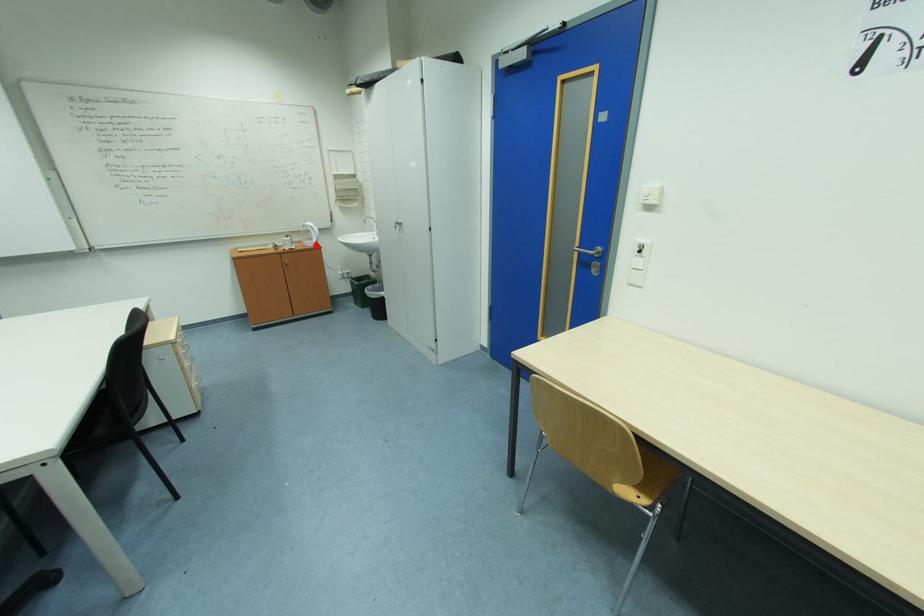
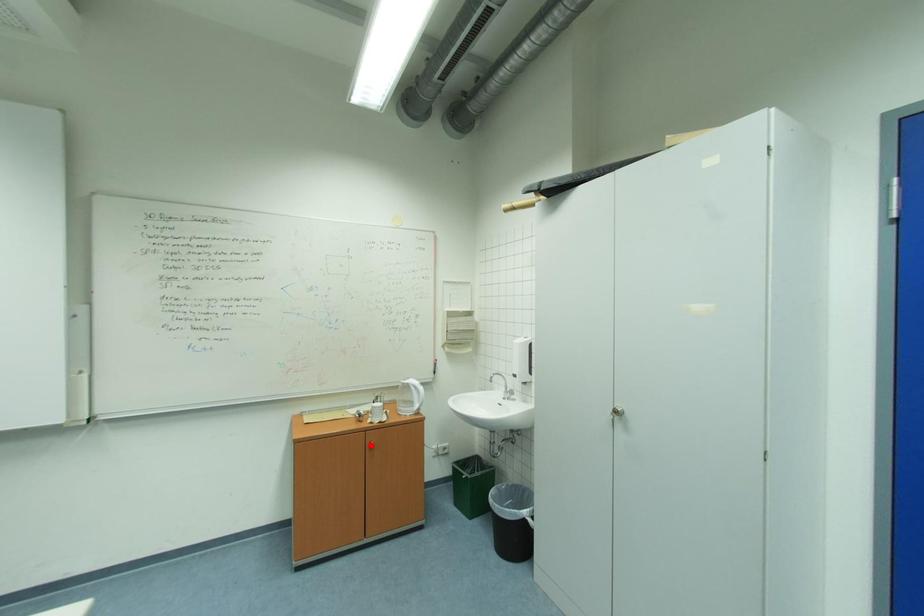
I am providing you with two images of the same scene from different viewpoints. A red point is marked on the first image and another point is marked on the second image. Is the marked point in image1 the same physical position as the marked point in image2?

No